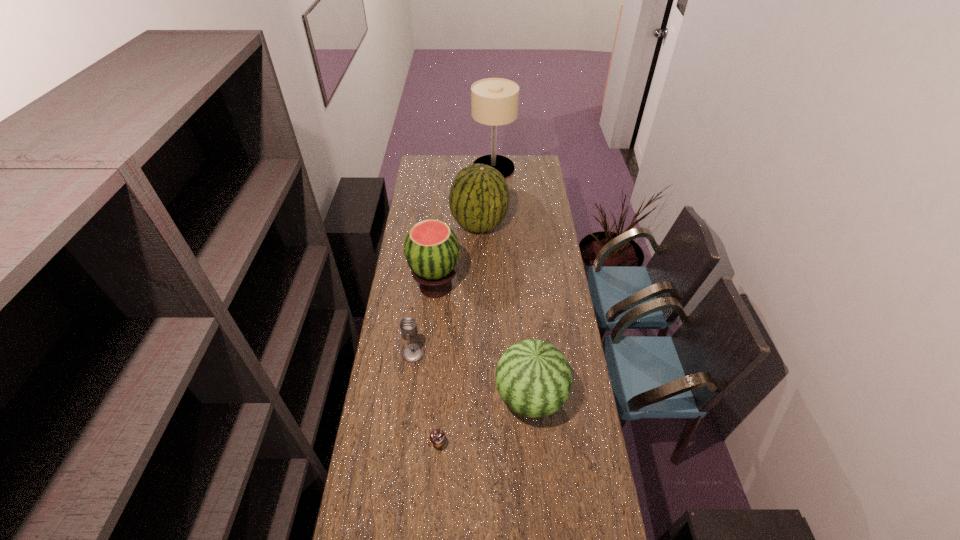
Where is `vacant space located 0.100m on the right of the farthest watermelon`? This screenshot has height=540, width=960. vacant space located 0.100m on the right of the farthest watermelon is located at coordinates (525, 225).

Find the location of a particular element. vacant space located 0.400m on the back of the third farthest object is located at coordinates (443, 218).

At what (x,y) coordinates should I click in order to perform the action: click on vacant space positioned 0.350m on the back of the fifth farthest object. Please return your answer as a coordinate pair (x, y). This screenshot has height=540, width=960. Looking at the image, I should click on (522, 302).

I want to click on free space located on the back of the fifth tallest object, so click(x=418, y=318).

Where is `free region located on the left of the nearest object`? This screenshot has height=540, width=960. free region located on the left of the nearest object is located at coordinates (403, 444).

Locate an element on the screen. This screenshot has width=960, height=540. object situated at the far edge is located at coordinates (494, 101).

Where is `watermelon located at the left edge`? The image size is (960, 540). watermelon located at the left edge is located at coordinates (431, 248).

Locate an element on the screen. This screenshot has height=540, width=960. microphone located in the left edge section of the desktop is located at coordinates (412, 352).

The width and height of the screenshot is (960, 540). In order to click on object located at the right edge in this screenshot , I will do `click(533, 377)`.

You are a GUI agent. You are given a task and a screenshot of the screen. Output one action in this format:
    pyautogui.click(x=<x>, y=<y>)
    Task: Click on the vacant space at the left edge of the desktop
    The height and width of the screenshot is (540, 960).
    Given the screenshot: What is the action you would take?
    pyautogui.click(x=399, y=383)